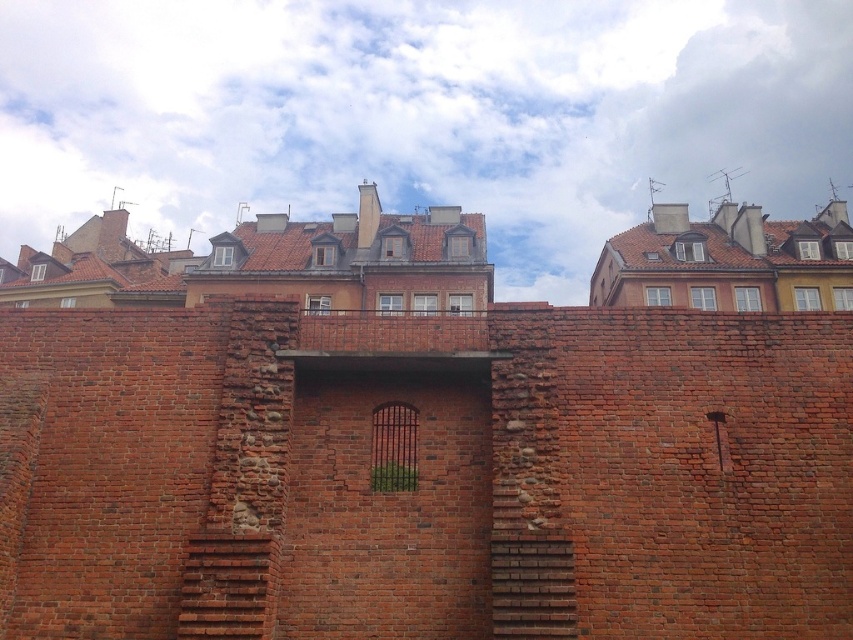
Question: Does brick stairs at center appear on the left side of smooth brick stairs at center?

Choices:
 (A) no
 (B) yes

Answer: (B)

Question: Can you confirm if brick stairs at center is bigger than smooth brick stairs at center?

Choices:
 (A) no
 (B) yes

Answer: (B)

Question: Is the position of brick stairs at center more distant than that of smooth brick stairs at center?

Choices:
 (A) no
 (B) yes

Answer: (B)

Question: Which point appears closest to the camera in this image?

Choices:
 (A) (537, 582)
 (B) (204, 588)

Answer: (B)